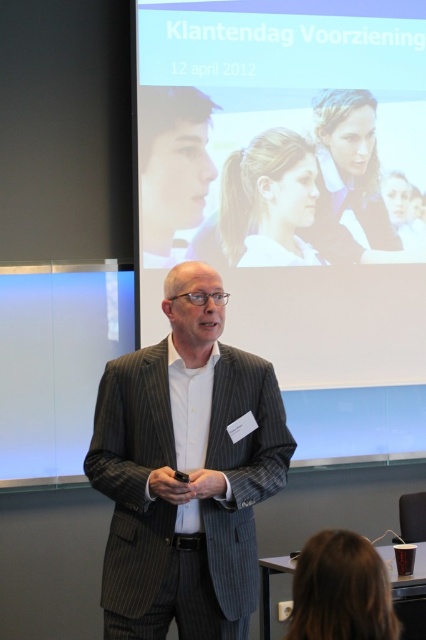
Question: Which of the following is the farthest from the observer?

Choices:
 (A) matte black face at upper left
 (B) striped wool suit at center

Answer: (A)

Question: Among these objects, which one is nearest to the camera?

Choices:
 (A) matte black face at upper left
 (B) striped wool suit at center

Answer: (B)

Question: Where is striped wool suit at center located in relation to matte black face at upper left in the image?

Choices:
 (A) below
 (B) above

Answer: (A)

Question: Can you confirm if striped wool suit at center is thinner than matte black face at upper left?

Choices:
 (A) no
 (B) yes

Answer: (A)

Question: Is striped wool suit at center bigger than matte black face at upper left?

Choices:
 (A) no
 (B) yes

Answer: (B)